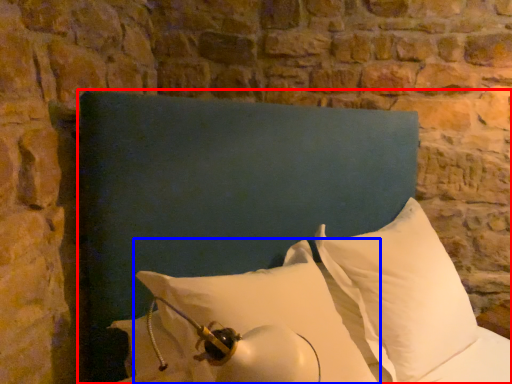
Question: Which object is closer to the camera taking this photo, furniture (highlighted by a red box) or pillow (highlighted by a blue box)?

Choices:
 (A) furniture
 (B) pillow

Answer: (A)